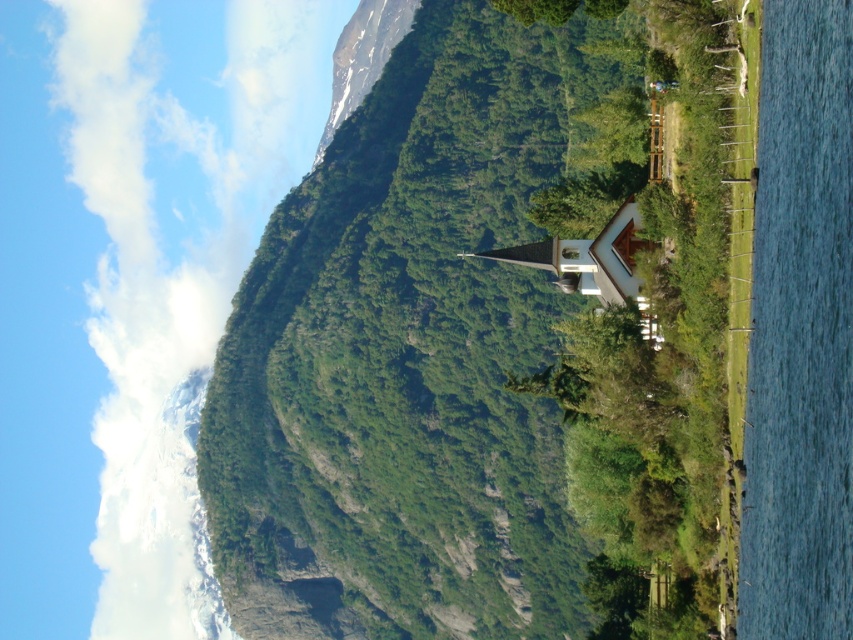
Can you confirm if green textured mountain at center is wider than white wooden chapel at center?

Yes, green textured mountain at center is wider than white wooden chapel at center.

Which is below, green textured mountain at center or white wooden chapel at center?

Positioned lower is white wooden chapel at center.

This screenshot has height=640, width=853. I want to click on green textured mountain at center, so click(483, 342).

The width and height of the screenshot is (853, 640). Find the location of `green textured mountain at center`. green textured mountain at center is located at coordinates (483, 342).